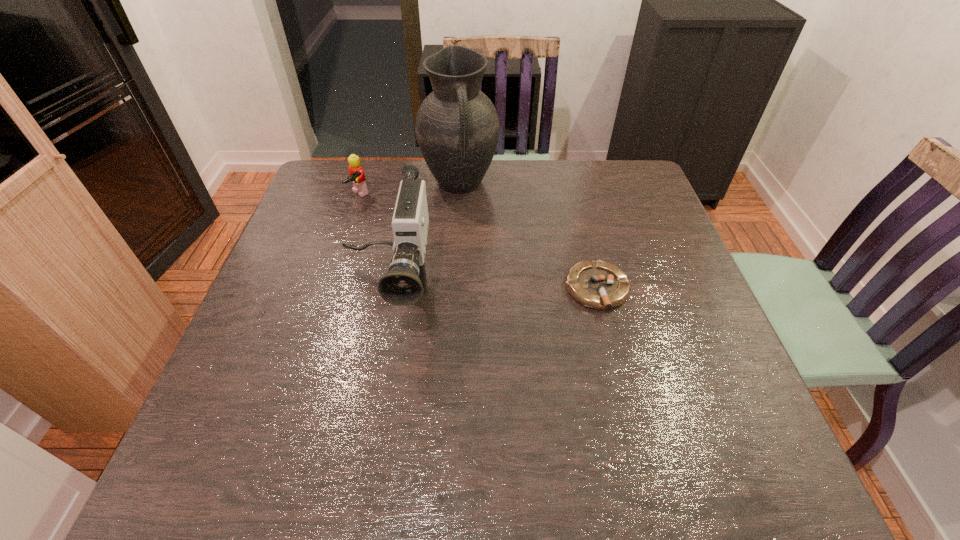
This screenshot has width=960, height=540. I want to click on vacant space on the desktop that is between the camcorder and the ashtray and is positioned on the side of the tallest object with the handle, so click(487, 289).

Locate an element on the screen. vacant spot on the desktop that is between the camcorder and the rightmost object and is positioned in front of the second shortest object with the accessory visible is located at coordinates (503, 289).